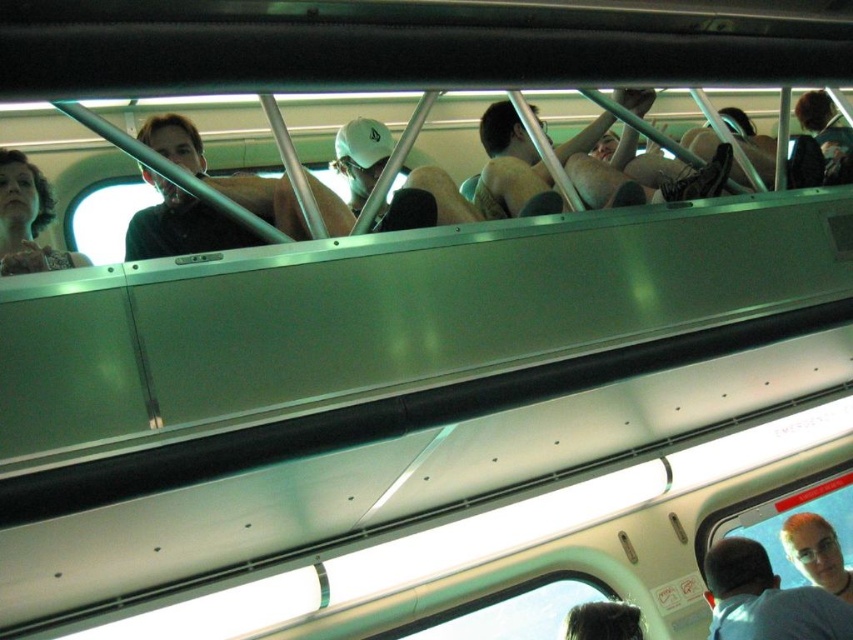
Question: Can you confirm if light brown hair at lower right is positioned above light brown hair at upper center?

Choices:
 (A) no
 (B) yes

Answer: (B)

Question: Which of the following is the closest to the observer?

Choices:
 (A) light brown hair at lower right
 (B) matte black shirt at left
 (C) shiny black hair at lower center
 (D) matte black hair at upper left

Answer: (D)

Question: Where is light brown hair at lower right located in relation to light brown hair at upper center in the image?

Choices:
 (A) below
 (B) above

Answer: (B)

Question: Which point is farther from the camera taking this photo?

Choices:
 (A) (184, 228)
 (B) (815, 544)

Answer: (B)

Question: Based on their relative distances, which object is farther from the shiny black hair at lower center?

Choices:
 (A) light brown hair at upper center
 (B) light brown hair at lower right
 (C) matte black shirt at left
 (D) matte black hair at upper left

Answer: (D)

Question: Can you confirm if matte black shirt at left is smaller than shiny black hair at lower center?

Choices:
 (A) yes
 (B) no

Answer: (B)